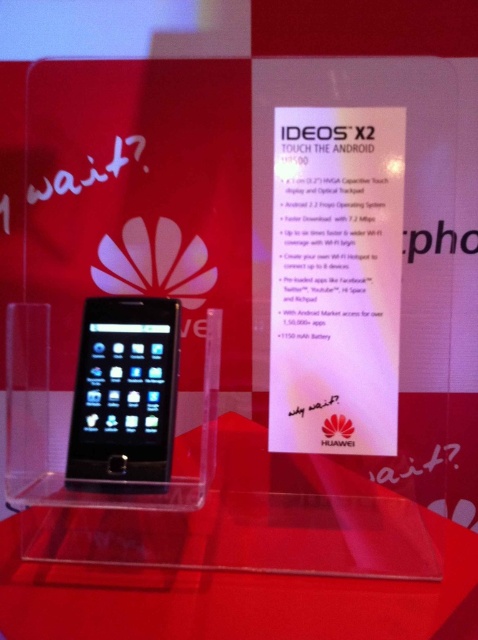
You are setting up a display for a tech event. You have a transparent acrylic table at center and a sleek black phone at center. Which object should you place first if you need to accommodate the larger item first?

You should place the transparent acrylic table at center first because it is larger in size than the sleek black phone at center.

You are looking at the Huawei IDEOS X2 smartphone in the stand. There are two points marked on the image. Which point is closer to you, point (281, 595) or point (174, 388)?

Point (281, 595) is in front of point (174, 388), so it is closer to you.